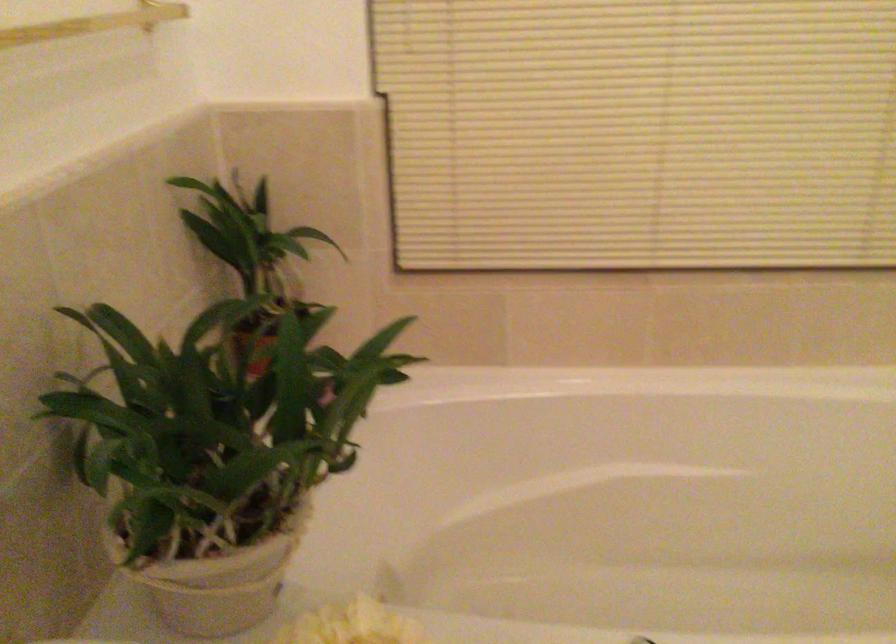
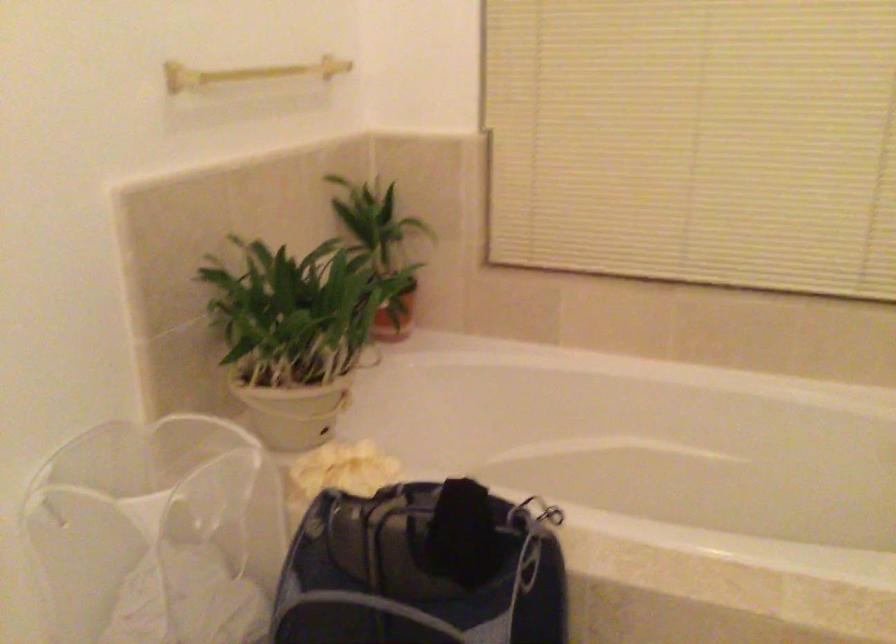
Question: The camera is either moving clockwise (left) or counter-clockwise (right) around the object. The first image is from the beginning of the video and the second image is from the end. Is the camera moving left or right when shooting the video?

Choices:
 (A) Left
 (B) Right

Answer: (B)